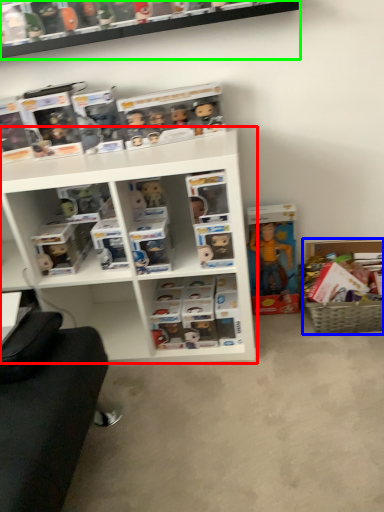
Question: Which object is the farthest from shelf (highlighted by a red box)? Choose among these: cabinet (highlighted by a blue box) or shelf (highlighted by a green box).

Choices:
 (A) cabinet
 (B) shelf

Answer: (A)